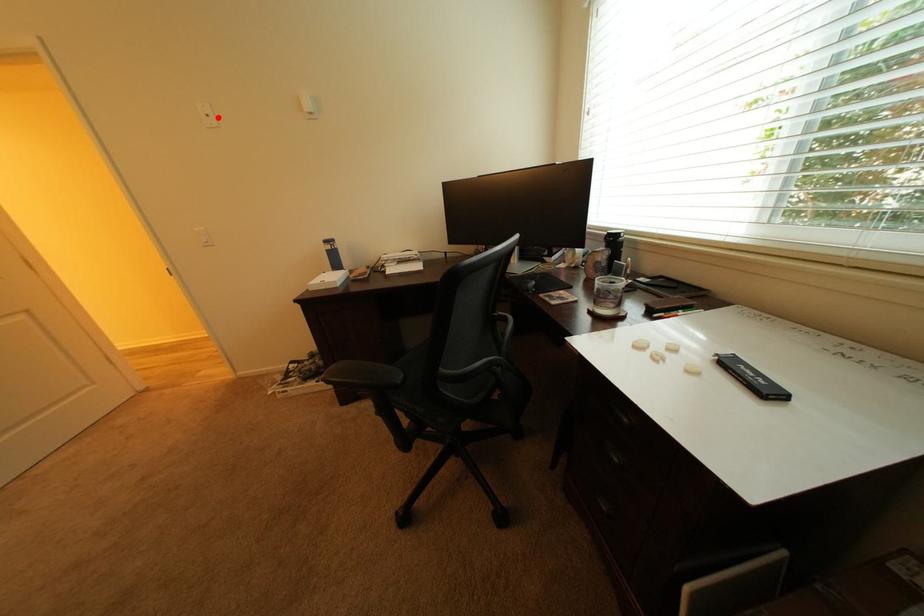
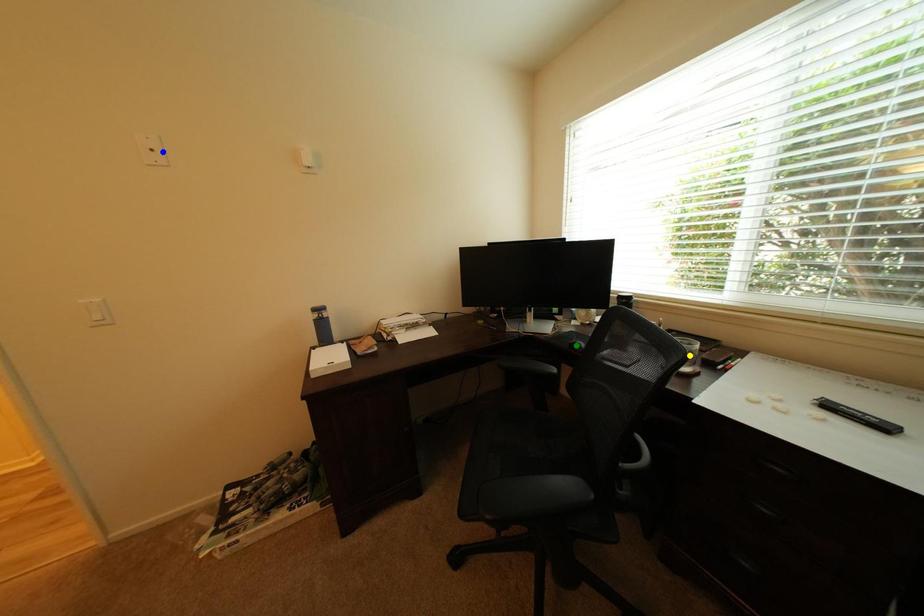
Question: I am providing you with two images of the same scene from different viewpoints. A red point is marked on the first image. You are given multiple points on the second image. Which spot in image 2 lines up with the point in image 1?

Choices:
 (A) yellow point
 (B) green point
 (C) blue point

Answer: (C)